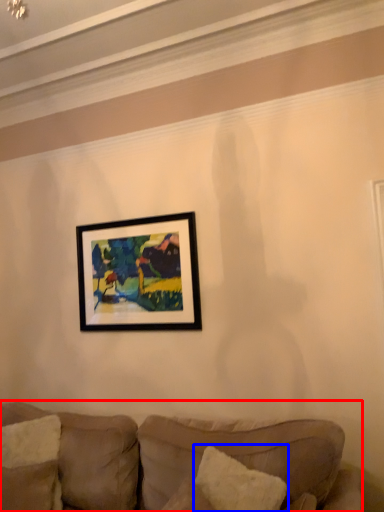
Question: Among these objects, which one is farthest to the camera, studio couch (highlighted by a red box) or pillow (highlighted by a blue box)?

Choices:
 (A) studio couch
 (B) pillow

Answer: (B)